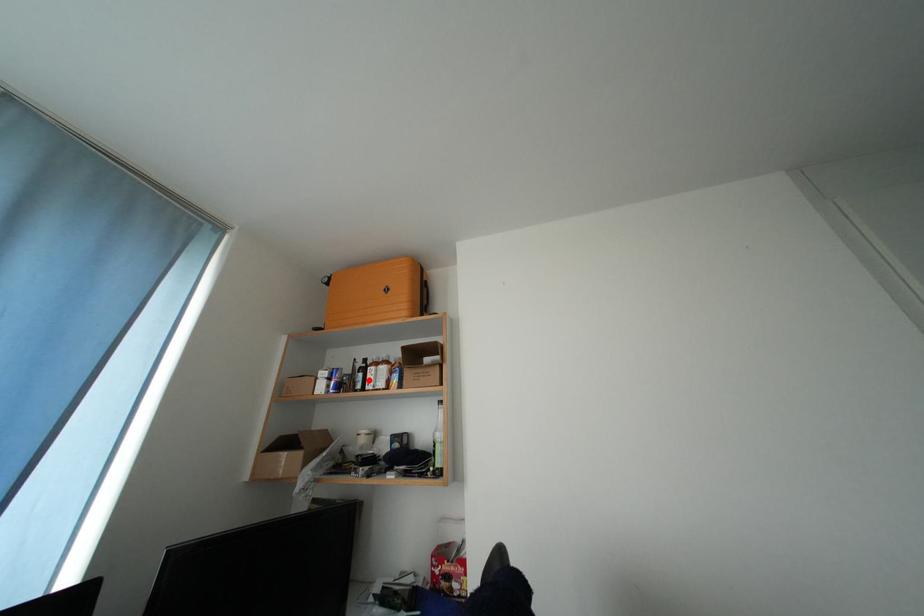
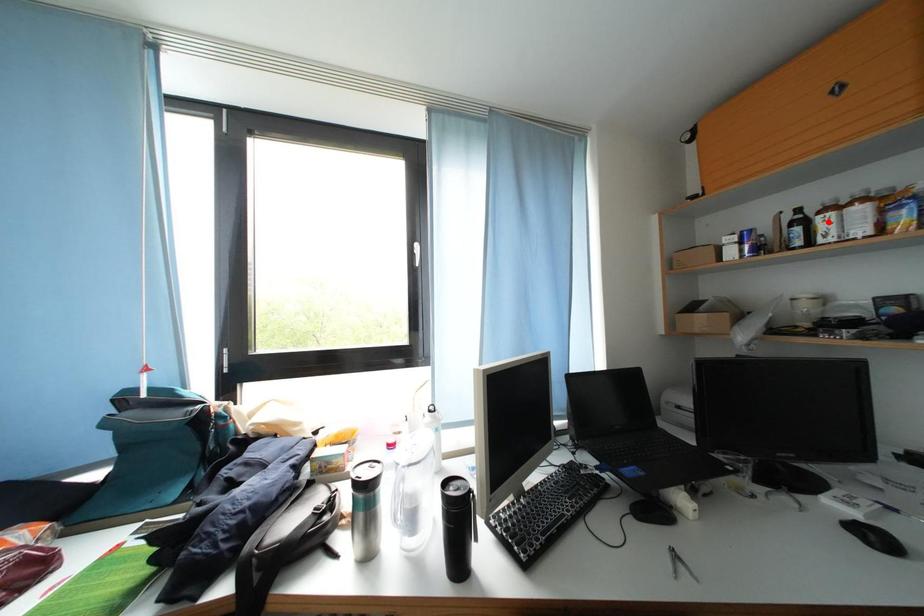
I am providing you with two images of the same scene from different viewpoints. A red point is marked on the first image and another point is marked on the second image. Are the points marked in image1 and image2 representing the same 3D position?

No